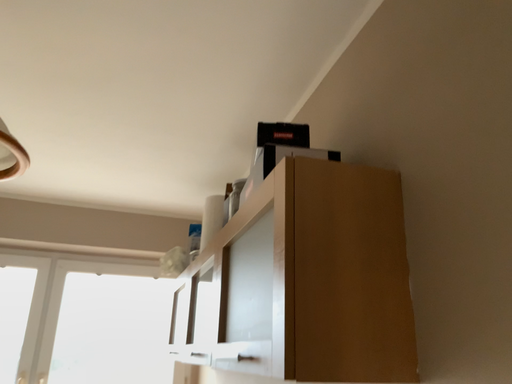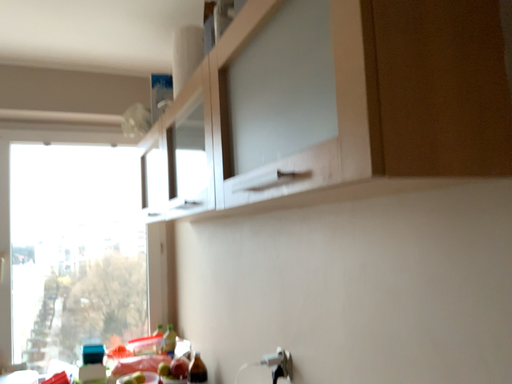
Question: How did the camera likely rotate when shooting the video?

Choices:
 (A) rotated right
 (B) rotated left

Answer: (A)